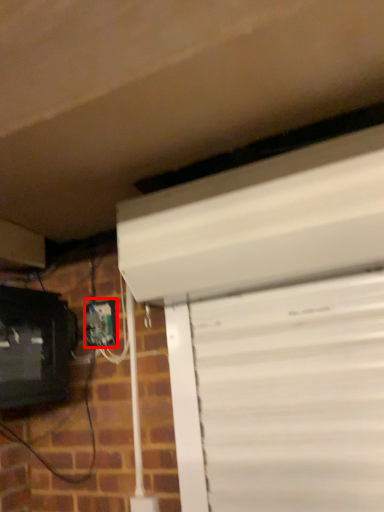
Question: From the image, what is the correct spatial relationship of electric outlet (annotated by the red box) in relation to computer monitor?

Choices:
 (A) left
 (B) right

Answer: (B)